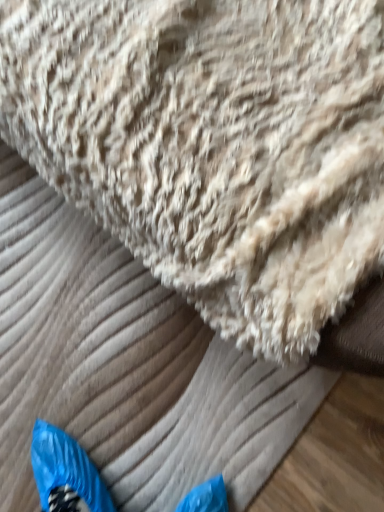
Question: Should I look upward or downward to see beige fluffy towel at upper center?

Choices:
 (A) up
 (B) down

Answer: (A)

Question: Is beige fluffy towel at upper center bigger than beige fluffy blanket at upper center?

Choices:
 (A) no
 (B) yes

Answer: (B)

Question: Is beige fluffy towel at upper center positioned in front of beige fluffy blanket at upper center?

Choices:
 (A) yes
 (B) no

Answer: (A)

Question: From a real-world perspective, is beige fluffy towel at upper center beneath beige fluffy blanket at upper center?

Choices:
 (A) no
 (B) yes

Answer: (A)

Question: Is beige fluffy blanket at upper center located within beige fluffy towel at upper center?

Choices:
 (A) no
 (B) yes

Answer: (A)

Question: Does beige fluffy towel at upper center lie behind beige fluffy blanket at upper center?

Choices:
 (A) yes
 (B) no

Answer: (B)

Question: Can you confirm if beige fluffy towel at upper center is positioned to the right of beige fluffy blanket at upper center?

Choices:
 (A) no
 (B) yes

Answer: (B)

Question: From a real-world perspective, is beige fluffy blanket at upper center physically below beige fluffy towel at upper center?

Choices:
 (A) no
 (B) yes

Answer: (B)

Question: Are beige fluffy blanket at upper center and beige fluffy towel at upper center located far from each other?

Choices:
 (A) no
 (B) yes

Answer: (A)

Question: Considering the relative sizes of beige fluffy blanket at upper center and beige fluffy towel at upper center in the image provided, is beige fluffy blanket at upper center taller than beige fluffy towel at upper center?

Choices:
 (A) yes
 (B) no

Answer: (B)

Question: Is beige fluffy blanket at upper center facing away from beige fluffy towel at upper center?

Choices:
 (A) no
 (B) yes

Answer: (A)

Question: Is beige fluffy blanket at upper center aimed at beige fluffy towel at upper center?

Choices:
 (A) yes
 (B) no

Answer: (B)

Question: Is beige fluffy towel at upper center completely or partially inside beige fluffy blanket at upper center?

Choices:
 (A) yes
 (B) no

Answer: (B)

Question: Based on their sizes in the image, would you say beige fluffy towel at upper center is bigger or smaller than beige fluffy blanket at upper center?

Choices:
 (A) small
 (B) big

Answer: (B)